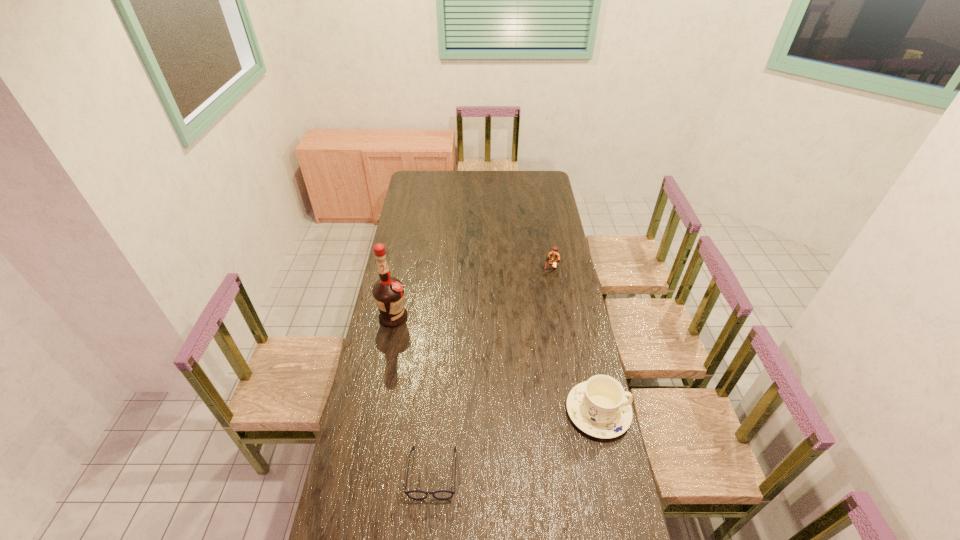
Where is `free space on the desktop that is between the third object from right to left and the chinaware and is positioned on the front and back of the tallest object`? This screenshot has width=960, height=540. free space on the desktop that is between the third object from right to left and the chinaware and is positioned on the front and back of the tallest object is located at coordinates (541, 432).

Identify the location of free space on the desktop that is between the shortest object and the second nearest object and is positioned holding a crossbow in the hands of the farthest object. (495, 449).